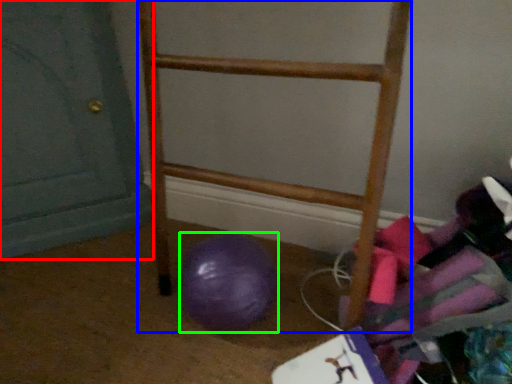
Question: Which object is positioned closest to door (highlighted by a red box)? Select from furniture (highlighted by a blue box) and ball (highlighted by a green box).

Choices:
 (A) furniture
 (B) ball

Answer: (A)